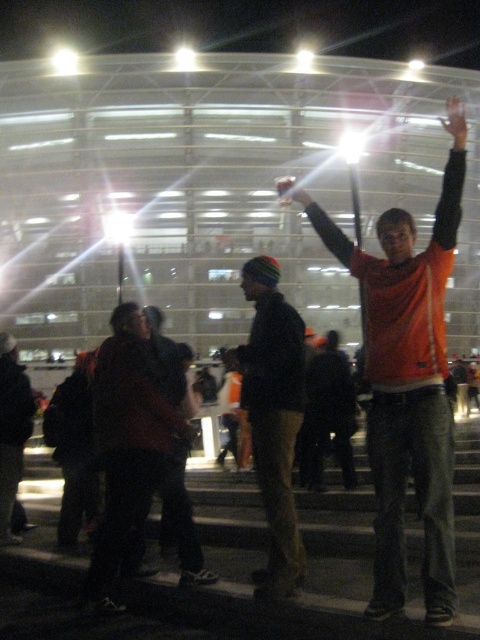
Can you confirm if knit cap at center is bigger than matte black hand at upper right?

No.

Who is more distant from viewer, (252, 413) or (448, 106)?

Point (448, 106)

I want to click on knit cap at center, so click(x=274, y=417).

Does matte black hand at upper right have a greater height compared to matte black hand at upper center?

Indeed, matte black hand at upper right has a greater height compared to matte black hand at upper center.

Is matte black hand at upper right behind matte black hand at upper center?

No, matte black hand at upper right is closer to the viewer.

Which is in front, point (457, 148) or point (280, 196)?

Point (457, 148) is more forward.

Locate an element on the screen. matte black hand at upper right is located at coordinates (456, 122).

Is dark brown leather jacket at lower left to the right of matte black hand at upper center from the viewer's perspective?

No, dark brown leather jacket at lower left is not to the right of matte black hand at upper center.

Between dark brown leather jacket at lower left and matte black hand at upper center, which one has more height?

matte black hand at upper center is taller.

Which is in front, point (25, 392) or point (287, 177)?

Point (25, 392) is more forward.

The width and height of the screenshot is (480, 640). What are the coordinates of `dark brown leather jacket at lower left` in the screenshot? It's located at (12, 429).